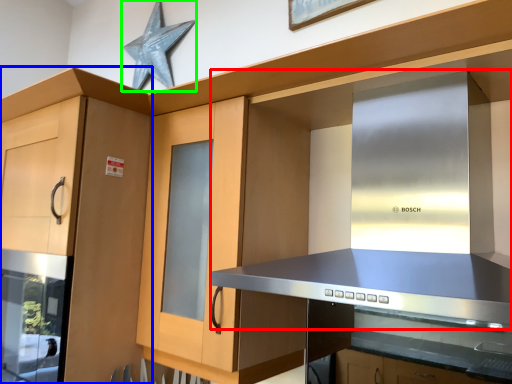
Question: Based on their relative distances, which object is farther from vent (highlighted by a red box)? Choose from cabinetry (highlighted by a blue box) and star (highlighted by a green box).

Choices:
 (A) cabinetry
 (B) star

Answer: (B)